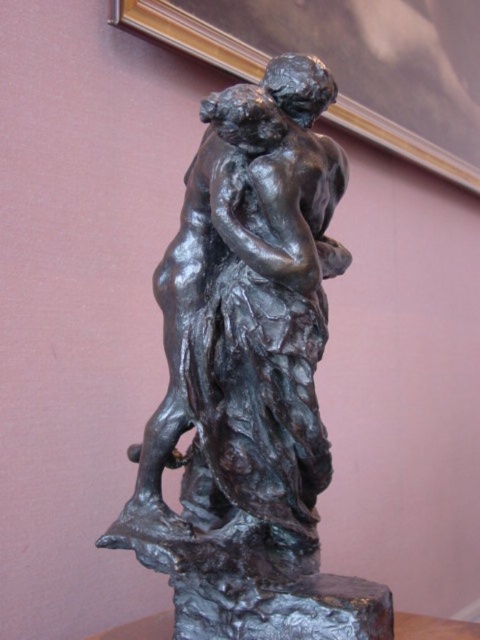
Which is more to the right, bronze statue at center or gold-framed picture at upper center?

gold-framed picture at upper center

Between point (310, 428) and point (474, 122), which one is positioned in front?

Positioned in front is point (310, 428).

Find the location of a particular element. Image resolution: width=480 pixels, height=640 pixels. bronze statue at center is located at coordinates (250, 378).